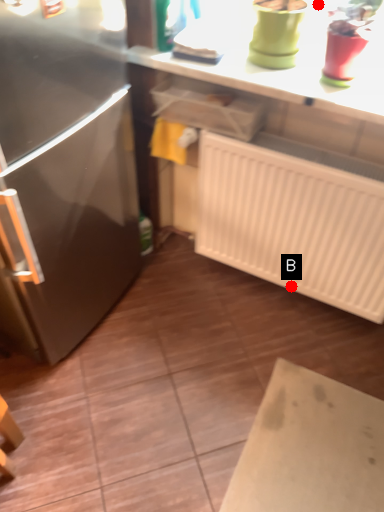
Question: Two points are circled on the image, labeled by A and B beside each circle. Which point is closer to the camera?

Choices:
 (A) A is closer
 (B) B is closer

Answer: (A)